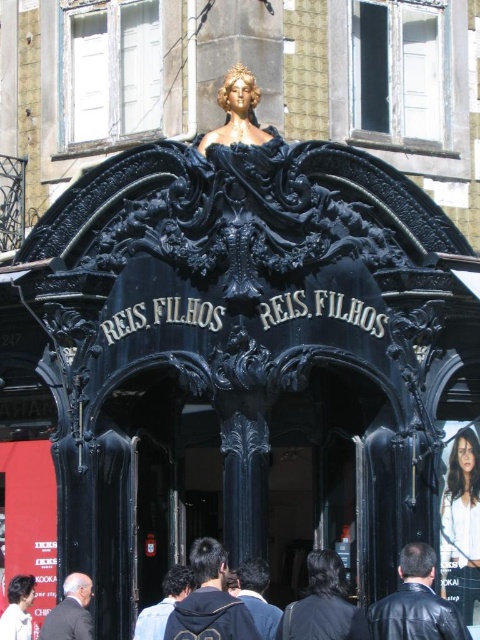
Is the position of dark blue jacket at lower center less distant than that of gold-painted statue at upper center?

That is True.

Is point (316, 602) more distant than point (259, 129)?

No, it is not.

What are the coordinates of `dark blue jacket at lower center` in the screenshot? It's located at (373, 604).

Based on the photo, who is lower down, black leather jacket at center or dark gray suit at lower left?

dark gray suit at lower left

Is black leather jacket at center wider than dark gray suit at lower left?

Yes.

Where is `black leather jacket at center`? black leather jacket at center is located at coordinates (210, 600).

Where is `leather jacket at lower right`? The width and height of the screenshot is (480, 640). leather jacket at lower right is located at coordinates click(x=416, y=602).

Does point (460, 636) come in front of point (194, 636)?

No, (460, 636) is behind (194, 636).

You are a GUI agent. You are given a task and a screenshot of the screen. Output one action in this format:
    pyautogui.click(x=<x>, y=<y>)
    Task: Click on the leather jacket at lower right
    Image resolution: width=480 pixels, height=640 pixels.
    Given the screenshot: What is the action you would take?
    pyautogui.click(x=416, y=602)